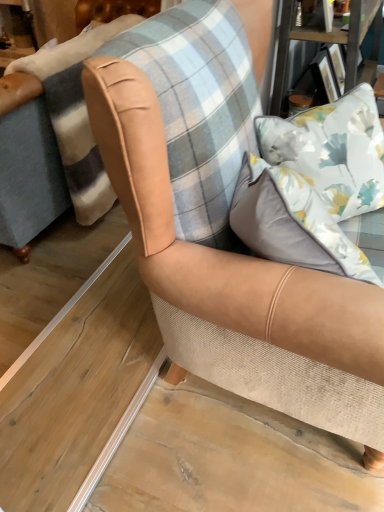
Question: Is white satin pillow at upper right, positioned as the second pillow in back-to-front order, to the right of floral fabric pillow at upper right, marked as the first pillow in a back-to-front arrangement, from the viewer's perspective?

Choices:
 (A) no
 (B) yes

Answer: (A)

Question: Does white satin pillow at upper right, positioned as the first pillow in front-to-back order, contain floral fabric pillow at upper right, the 2th pillow when ordered from front to back?

Choices:
 (A) yes
 (B) no

Answer: (B)

Question: Is white satin pillow at upper right, positioned as the first pillow in front-to-back order, far from floral fabric pillow at upper right, the 2th pillow when ordered from front to back?

Choices:
 (A) yes
 (B) no

Answer: (B)

Question: Considering the relative positions of white satin pillow at upper right, positioned as the first pillow in front-to-back order, and floral fabric pillow at upper right, marked as the first pillow in a back-to-front arrangement, in the image provided, is white satin pillow at upper right, positioned as the first pillow in front-to-back order, behind floral fabric pillow at upper right, marked as the first pillow in a back-to-front arrangement,?

Choices:
 (A) no
 (B) yes

Answer: (A)

Question: From a real-world perspective, does white satin pillow at upper right, positioned as the first pillow in front-to-back order, stand above floral fabric pillow at upper right, the 2th pillow when ordered from front to back?

Choices:
 (A) no
 (B) yes

Answer: (B)

Question: Can you confirm if white satin pillow at upper right, positioned as the first pillow in front-to-back order, is smaller than floral fabric pillow at upper right, the 2th pillow when ordered from front to back?

Choices:
 (A) yes
 (B) no

Answer: (A)

Question: From a real-world perspective, does tan leather armchair at center stand above white satin pillow at upper right, positioned as the second pillow in back-to-front order?

Choices:
 (A) no
 (B) yes

Answer: (A)

Question: From the image's perspective, would you say tan leather armchair at center is shown under white satin pillow at upper right, positioned as the second pillow in back-to-front order?

Choices:
 (A) no
 (B) yes

Answer: (B)

Question: Does tan leather armchair at center have a greater width compared to white satin pillow at upper right, positioned as the first pillow in front-to-back order?

Choices:
 (A) no
 (B) yes

Answer: (B)

Question: Is the position of tan leather armchair at center more distant than that of white satin pillow at upper right, positioned as the first pillow in front-to-back order?

Choices:
 (A) no
 (B) yes

Answer: (B)

Question: Does tan leather armchair at center have a larger size compared to white satin pillow at upper right, positioned as the second pillow in back-to-front order?

Choices:
 (A) no
 (B) yes

Answer: (B)

Question: From the image's perspective, is tan leather armchair at center over white satin pillow at upper right, positioned as the second pillow in back-to-front order?

Choices:
 (A) yes
 (B) no

Answer: (B)

Question: Is tan leather armchair at center completely or partially inside white satin pillow at upper right, positioned as the first pillow in front-to-back order?

Choices:
 (A) no
 (B) yes

Answer: (A)